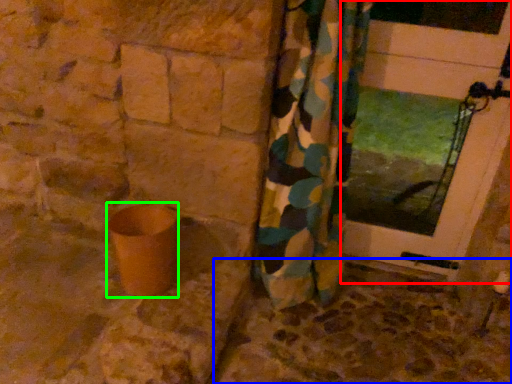
Question: Which is nearer to the door (highlighted by a red box)? concrete (highlighted by a blue box) or pottery (highlighted by a green box).

Choices:
 (A) concrete
 (B) pottery

Answer: (A)